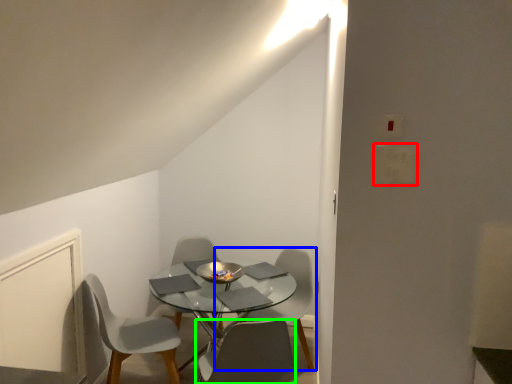
Question: Which object is the closest to the light switch (highlighted by a red box)? Choose among these: chair (highlighted by a blue box) or chair (highlighted by a green box).

Choices:
 (A) chair
 (B) chair

Answer: (B)